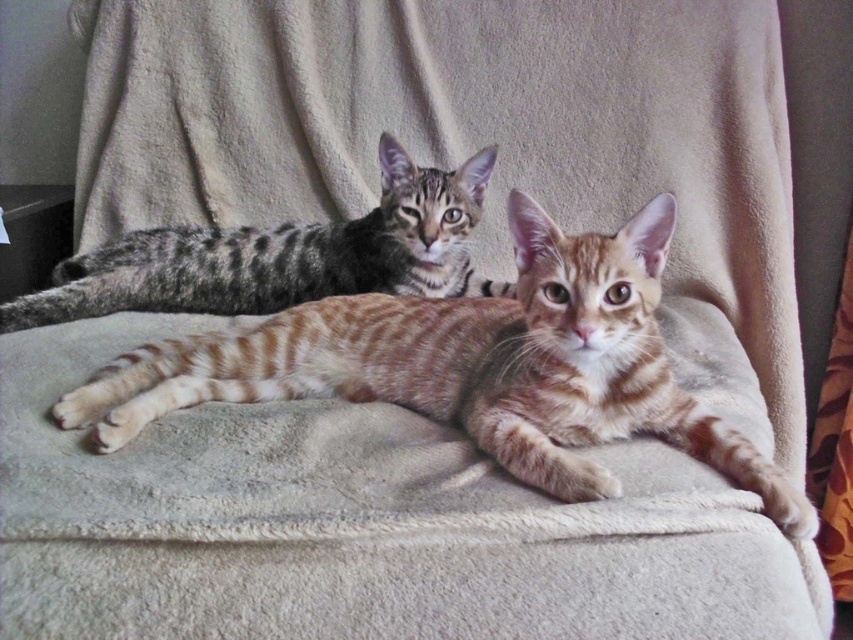
Question: Can you confirm if golden tabby cat at center is positioned to the left of gray striped kitten at upper left?

Choices:
 (A) no
 (B) yes

Answer: (A)

Question: Which of the following is the farthest from the observer?

Choices:
 (A) gray striped kitten at upper left
 (B) golden tabby cat at center

Answer: (A)

Question: Which point is closer to the camera?

Choices:
 (A) gray striped kitten at upper left
 (B) golden tabby cat at center

Answer: (B)

Question: Which point appears farthest from the camera in this image?

Choices:
 (A) (383, 252)
 (B) (595, 490)

Answer: (A)

Question: Can you confirm if golden tabby cat at center is wider than gray striped kitten at upper left?

Choices:
 (A) yes
 (B) no

Answer: (B)

Question: Is golden tabby cat at center to the right of gray striped kitten at upper left from the viewer's perspective?

Choices:
 (A) no
 (B) yes

Answer: (B)